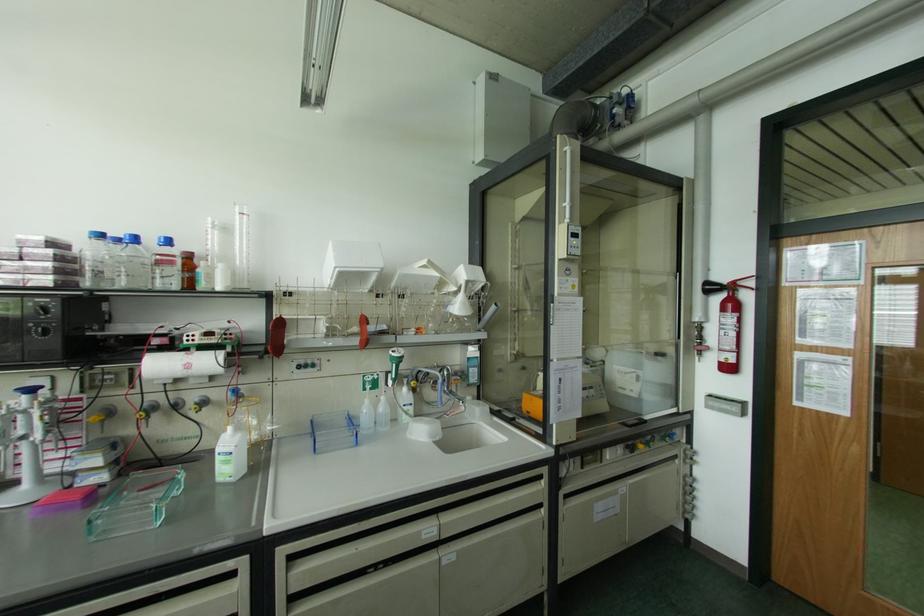
Identify the location of white fume hood handle. (351, 265).